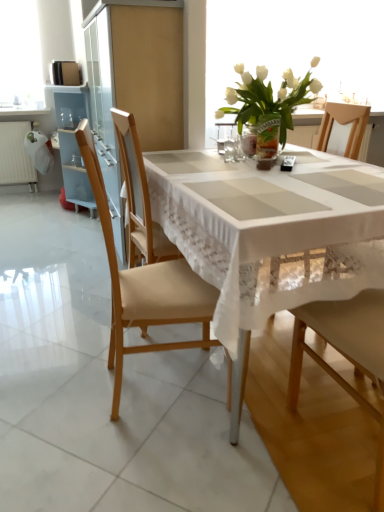
At what (x,y) coordinates should I click in order to perform the action: click on vacant space in front of translucent glass vase at center. Please return your answer as a coordinate pair (x, y). This screenshot has width=384, height=512. Looking at the image, I should click on (284, 165).